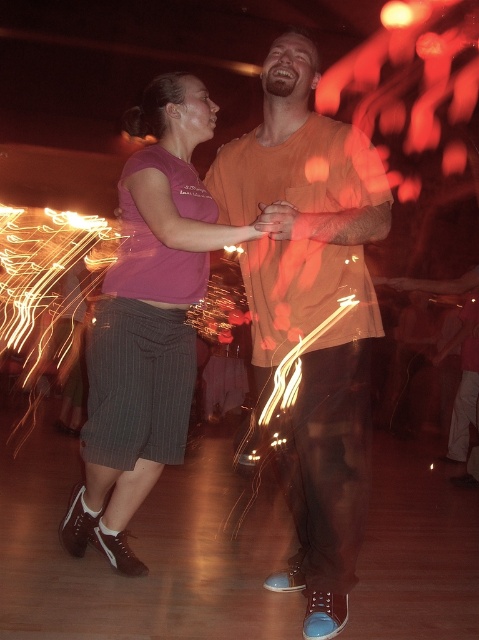
Question: Which object appears closest to the camera in this image?

Choices:
 (A) purple cotton shirt at center
 (B) orange cotton shirt at center

Answer: (B)

Question: Is orange cotton shirt at center positioned in front of purple cotton shirt at center?

Choices:
 (A) yes
 (B) no

Answer: (A)

Question: Is orange cotton shirt at center below purple cotton shirt at center?

Choices:
 (A) yes
 (B) no

Answer: (B)

Question: Among these objects, which one is farthest from the camera?

Choices:
 (A) purple cotton shirt at center
 (B) orange cotton shirt at center

Answer: (A)

Question: Which point is closer to the camera taking this photo?

Choices:
 (A) (301, 556)
 (B) (180, 330)

Answer: (A)

Question: Does orange cotton shirt at center appear on the right side of purple cotton shirt at center?

Choices:
 (A) no
 (B) yes

Answer: (B)